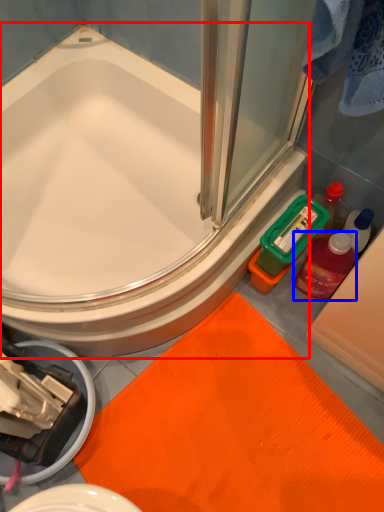
Question: Which of the following is the closest to the observer, bathtub (highlighted by a red box) or mouthwash (highlighted by a blue box)?

Choices:
 (A) bathtub
 (B) mouthwash

Answer: (A)